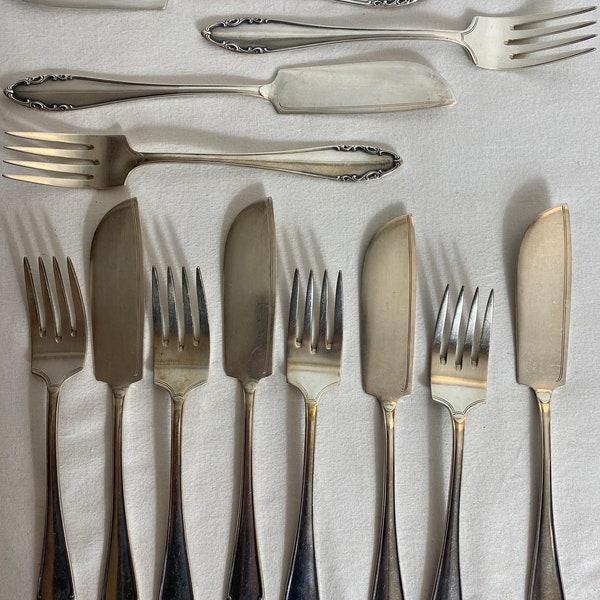
Locate an element on the screen. This screenshot has height=600, width=600. butter knife is located at coordinates (66, 87), (114, 571), (251, 561), (388, 561), (550, 565), (151, 3).